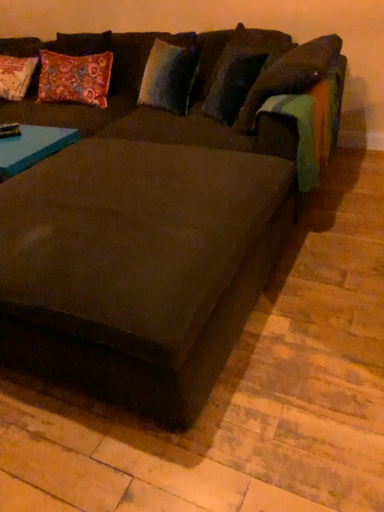
Question: Is velvety blue pillow at upper center, arranged as the second pillow when viewed from the right, positioned in front of suede-like dark brown couch at center?

Choices:
 (A) yes
 (B) no

Answer: (B)

Question: Considering the relative sizes of velvety blue pillow at upper center, positioned as the 1th pillow in left-to-right order, and suede-like dark brown couch at center in the image provided, is velvety blue pillow at upper center, positioned as the 1th pillow in left-to-right order, taller than suede-like dark brown couch at center?

Choices:
 (A) no
 (B) yes

Answer: (A)

Question: Is velvety blue pillow at upper center, arranged as the second pillow when viewed from the right, thinner than suede-like dark brown couch at center?

Choices:
 (A) no
 (B) yes

Answer: (B)

Question: Is velvety blue pillow at upper center, positioned as the 1th pillow in left-to-right order, next to suede-like dark brown couch at center?

Choices:
 (A) yes
 (B) no

Answer: (B)

Question: Is velvety blue pillow at upper center, positioned as the 1th pillow in left-to-right order, looking in the opposite direction of suede-like dark brown couch at center?

Choices:
 (A) yes
 (B) no

Answer: (A)

Question: Can you see velvety blue pillow at upper center, positioned as the 1th pillow in left-to-right order, touching velvety brown pillow at upper right, the 1th pillow from the right?

Choices:
 (A) yes
 (B) no

Answer: (B)

Question: Is velvety blue pillow at upper center, positioned as the 1th pillow in left-to-right order, taller than velvety brown pillow at upper right, which ranks as the second pillow in left-to-right order?

Choices:
 (A) no
 (B) yes

Answer: (A)

Question: Is velvety blue pillow at upper center, positioned as the 1th pillow in left-to-right order, outside of velvety brown pillow at upper right, which ranks as the second pillow in left-to-right order?

Choices:
 (A) no
 (B) yes

Answer: (B)

Question: Does velvety blue pillow at upper center, positioned as the 1th pillow in left-to-right order, come behind velvety brown pillow at upper right, the 1th pillow from the right?

Choices:
 (A) yes
 (B) no

Answer: (A)

Question: Can you confirm if velvety blue pillow at upper center, positioned as the 1th pillow in left-to-right order, is shorter than velvety brown pillow at upper right, the 1th pillow from the right?

Choices:
 (A) no
 (B) yes

Answer: (B)

Question: Can you confirm if velvety blue pillow at upper center, arranged as the second pillow when viewed from the right, is smaller than velvety brown pillow at upper right, which ranks as the second pillow in left-to-right order?

Choices:
 (A) yes
 (B) no

Answer: (A)

Question: Considering the relative sizes of suede-like dark brown couch at center and velvety blue pillow at upper center, arranged as the second pillow when viewed from the right, in the image provided, is suede-like dark brown couch at center taller than velvety blue pillow at upper center, arranged as the second pillow when viewed from the right,?

Choices:
 (A) no
 (B) yes

Answer: (B)